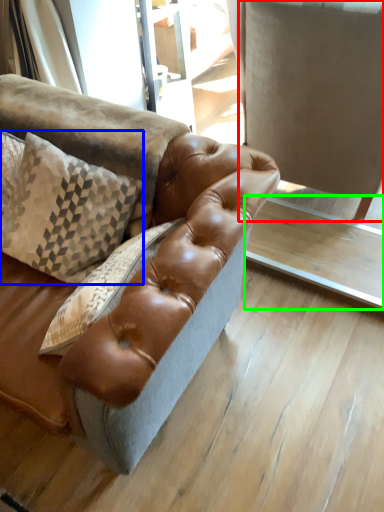
Question: Considering the real-world distances, which object is closest to swivel chair (highlighted by a red box)? pillow (highlighted by a blue box) or table (highlighted by a green box).

Choices:
 (A) pillow
 (B) table

Answer: (B)